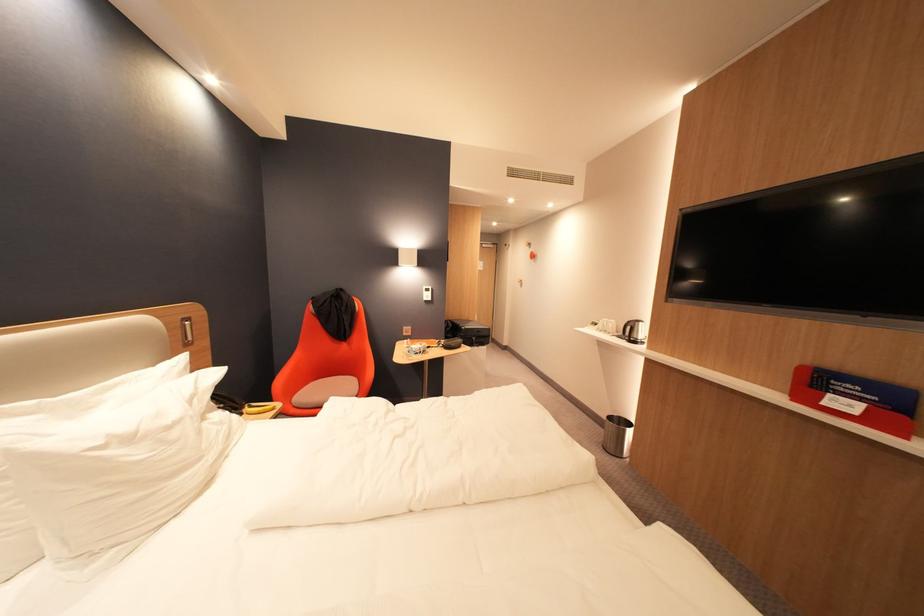
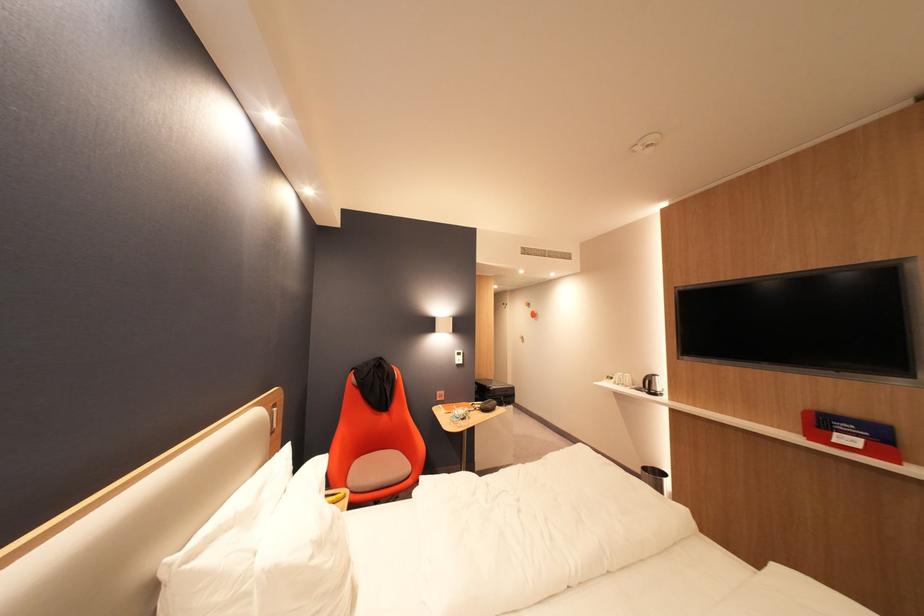
The point at (x=606, y=325) is marked in the first image. Where is the corresponding point in the second image?

(622, 379)